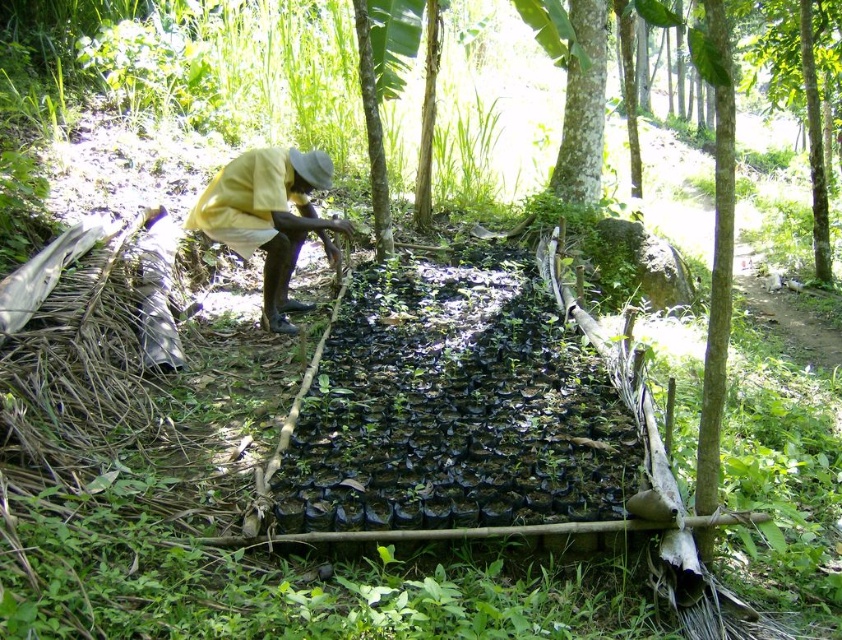
You are a farmer who needs to place a 2.5 meter long irrigation pipe between the yellow fabric at center and the green rough bark tree at upper center. Can the pipe fit between them without bending?

The distance between the yellow fabric at center and the green rough bark tree at upper center is 3.92 meters, which is longer than the 2.5 meter pipe. Therefore, the pipe can fit between them without bending.

You are standing in the rural outdoor scene and want to place a small potted plant between the yellow fabric at center and the green rough bark tree at upper center. Based on their positions, which object should the plant be closer to?

The yellow fabric at center is positioned on the left side of green rough bark tree at upper center, so the plant should be placed closer to the yellow fabric at center to be between them.

You are a farmer working in this field. You need to place a new tool shed that must be smaller than the existing green rough bark tree at upper center. Can the yellow fabric at center be used as a reference for the shed size?

The yellow fabric at center has a smaller size compared to the green rough bark tree at upper center, so yes, the yellow fabric at center can be used as a reference for the shed size since it is smaller than the tree.